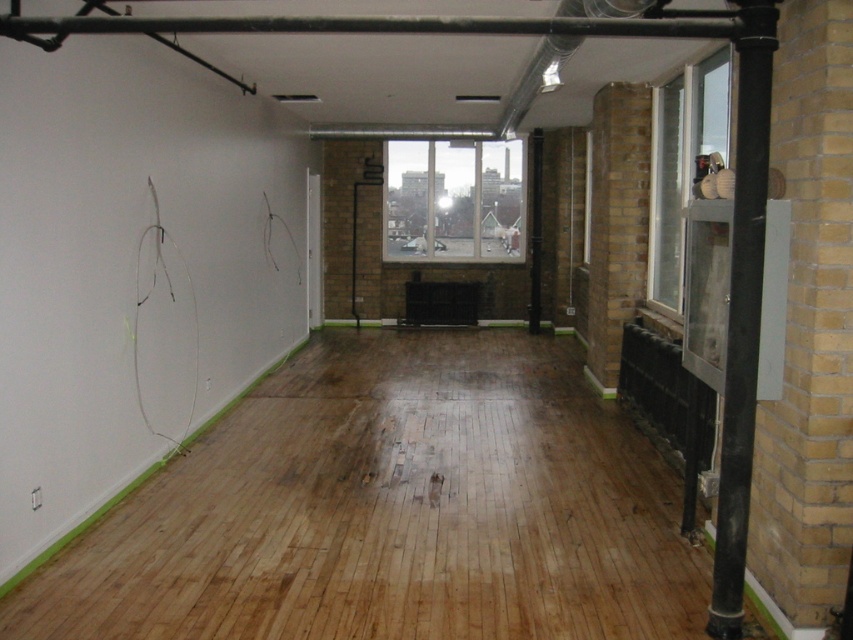
Can you confirm if black metal pole at right is thinner than clear glass window at center?

Correct, black metal pole at right's width is less than clear glass window at center's.

Does black metal pole at right appear on the right side of clear glass window at center?

Correct, you'll find black metal pole at right to the right of clear glass window at center.

Does point (743, 164) lie behind point (440, 148)?

No, (743, 164) is in front of (440, 148).

The width and height of the screenshot is (853, 640). I want to click on black metal pole at right, so click(741, 310).

Is point (734, 320) positioned before point (654, 138)?

Yes, point (734, 320) is closer to viewer.

This screenshot has height=640, width=853. I want to click on black metal pole at right, so click(x=741, y=310).

Is natural wood flooring at center further to camera compared to black metal pole at right?

That is True.

Is natural wood flooring at center taller than black metal pole at right?

In fact, natural wood flooring at center may be shorter than black metal pole at right.

Looking at this image, who is more forward, (608, 476) or (757, 284)?

Point (757, 284) is in front.

Locate an element on the screen. natural wood flooring at center is located at coordinates (392, 509).